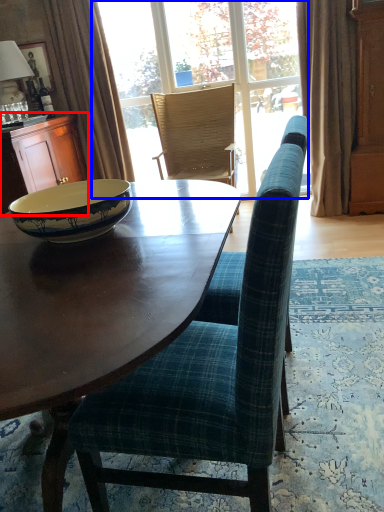
Question: Which object appears closest to the camera in this image, cabinetry (highlighted by a red box) or window (highlighted by a blue box)?

Choices:
 (A) cabinetry
 (B) window

Answer: (A)